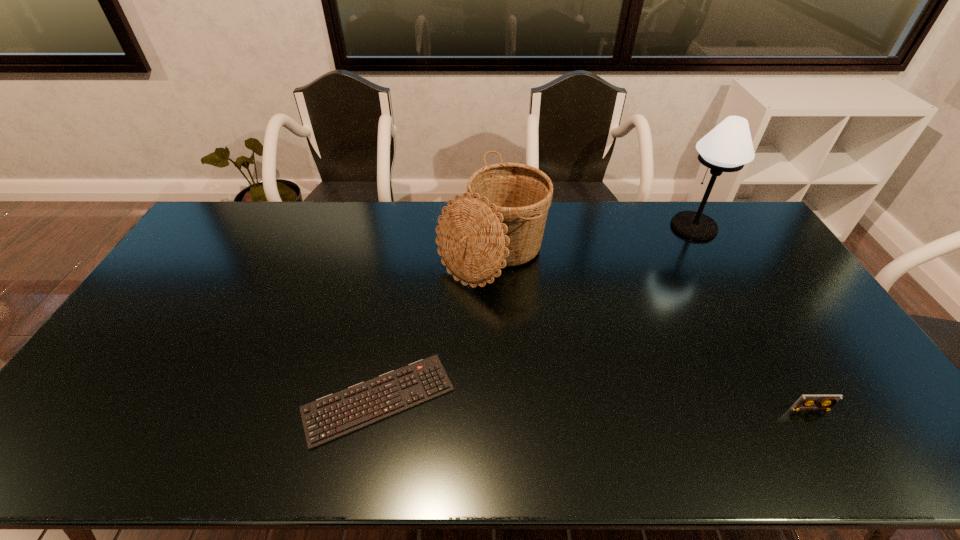
The height and width of the screenshot is (540, 960). Identify the location of object positioned at the near edge. (336, 415).

The image size is (960, 540). I want to click on table lamp present at the right edge, so click(x=728, y=147).

The width and height of the screenshot is (960, 540). Find the location of `videotape present at the right edge`. videotape present at the right edge is located at coordinates pos(807,402).

Image resolution: width=960 pixels, height=540 pixels. I want to click on object that is at the far right corner, so click(x=728, y=147).

Image resolution: width=960 pixels, height=540 pixels. In order to click on vacant space at the far edge of the desktop in this screenshot , I will do `click(583, 223)`.

I want to click on vacant area at the near edge, so click(366, 456).

Identify the location of vacant region at the left edge. The height and width of the screenshot is (540, 960). (x=131, y=335).

Image resolution: width=960 pixels, height=540 pixels. Find the location of `blank space at the right edge of the desktop`. blank space at the right edge of the desktop is located at coordinates (801, 360).

Where is `vacant point located between the computer keyboard and the second tallest object`? This screenshot has width=960, height=540. vacant point located between the computer keyboard and the second tallest object is located at coordinates (435, 326).

Find the location of a particular element. blank region between the basket and the shortest object is located at coordinates (435, 326).